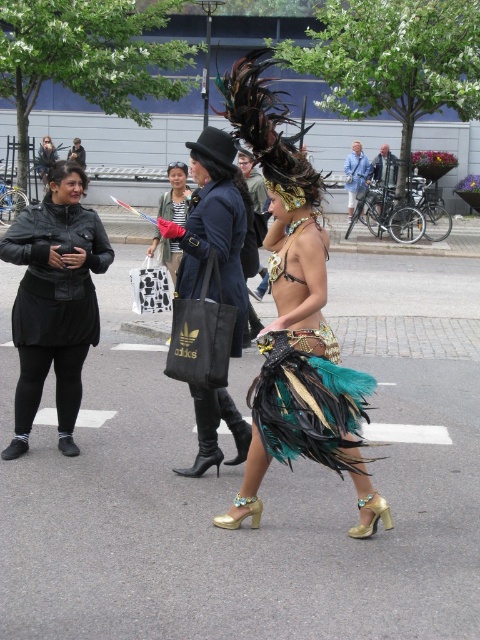
Can you confirm if feathered costume at center is positioned to the right of black lace bikini top at center?

Correct, you'll find feathered costume at center to the right of black lace bikini top at center.

Is feathered costume at center thinner than black lace bikini top at center?

In fact, feathered costume at center might be wider than black lace bikini top at center.

Is point (356, 390) farther from camera compared to point (274, 250)?

No, it is not.

Where is `feathered costume at center`? The height and width of the screenshot is (640, 480). feathered costume at center is located at coordinates (311, 305).

Who is lower down, metallic silver bicycle at center or gold leather high-heeled sandal at lower center?

gold leather high-heeled sandal at lower center is below.

Between metallic silver bicycle at center and gold leather high-heeled sandal at lower center, which one is positioned higher?

metallic silver bicycle at center

I want to click on metallic silver bicycle at center, so click(384, 168).

Does point (36, 310) come closer to viewer compared to point (374, 179)?

Yes, point (36, 310) is in front of point (374, 179).

Which is more to the right, black leather jacket at left or metallic silver bicycle at center?

From the viewer's perspective, metallic silver bicycle at center appears more on the right side.

This screenshot has width=480, height=640. I want to click on black leather jacket at left, so click(x=55, y=300).

Identify the location of black leather jacket at left. The image size is (480, 640). (55, 300).